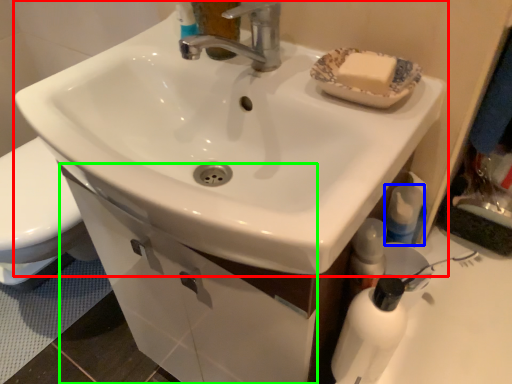
Question: Which object is the closest to the sink (highlighted by a red box)? Choose among these: mouthwash (highlighted by a blue box) or drawer (highlighted by a green box).

Choices:
 (A) mouthwash
 (B) drawer

Answer: (B)